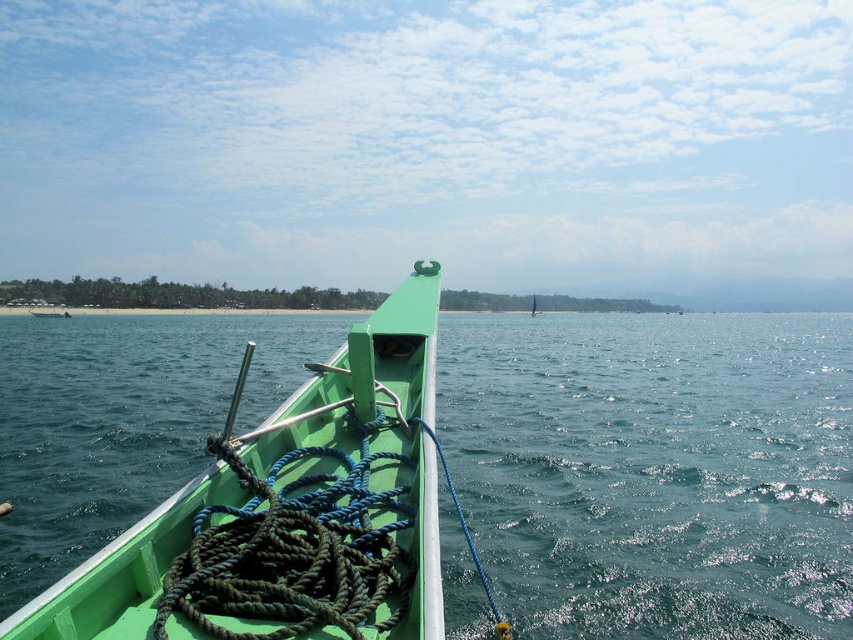
You are a sailor on a small green boat and need to choose between the dark green rope at center and the blue braided rope at center for securing the boat. Which rope is more suitable for tying a heavy anchor?

The dark green rope at center is bigger than the blue braided rope at center, so it is more suitable for tying a heavy anchor because it can handle more weight.

You are a sailor on a small green boat and need to secure the boat using the ropes. Which rope, the dark green rope at center or the blue braided rope at center, is closer to you?

The dark green rope at center is closer to you because it is in front of the blue braided rope at center.

You are standing on a dock and see the green matte boat at center anchored in the water. If you want to throw a lifebuoy to someone on the boat, and the lifebuoy has a maximum throwing range of 3 meters, will you be able to reach them?

The distance between you and the green matte boat at center is 3.05 meters. Since the lifebuoy can only reach 3 meters, you are 0.05 meters too far to successfully throw it to them.